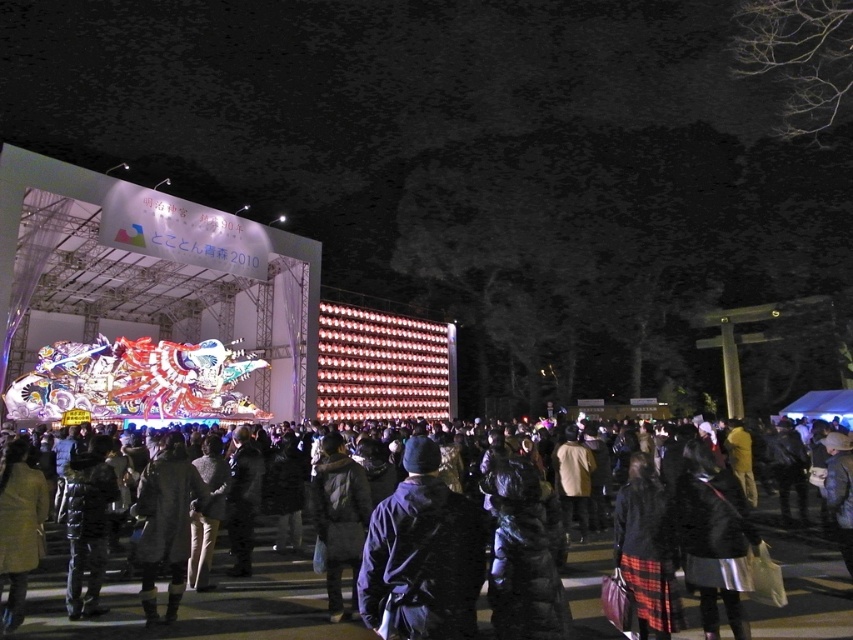
Question: Is dark gray wool coat at center thinner than dark blue jacket at center?

Choices:
 (A) no
 (B) yes

Answer: (A)

Question: Estimate the real-world distances between objects in this image. Which object is farther from the dark blue jacket at center?

Choices:
 (A) dark gray coat at center
 (B) dark gray wool coat at center
 (C) dark gray jacket at center

Answer: (A)

Question: Which of the following is the farthest from the observer?

Choices:
 (A) dark gray jacket at center
 (B) dark blue jacket at center
 (C) dark gray wool coat at center

Answer: (A)

Question: Among these points, which one is nearest to the camera?

Choices:
 (A) (305, 618)
 (B) (479, 512)
 (C) (186, 476)

Answer: (B)

Question: From the image, what is the correct spatial relationship of dark gray wool coat at center in relation to dark gray jacket at center?

Choices:
 (A) below
 (B) above

Answer: (A)

Question: Can you confirm if dark gray wool coat at center is bigger than dark gray coat at center?

Choices:
 (A) yes
 (B) no

Answer: (A)